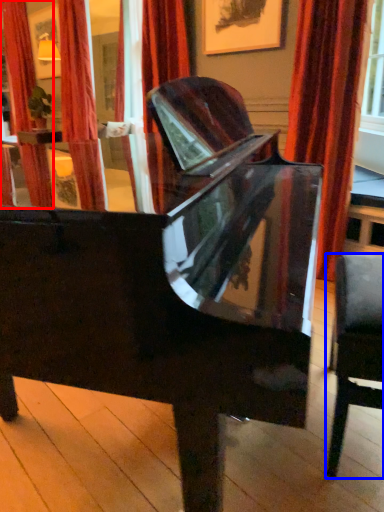
Question: Which point is closer to the camera, curtain (highlighted by a red box) or chair (highlighted by a blue box)?

Choices:
 (A) curtain
 (B) chair

Answer: (B)